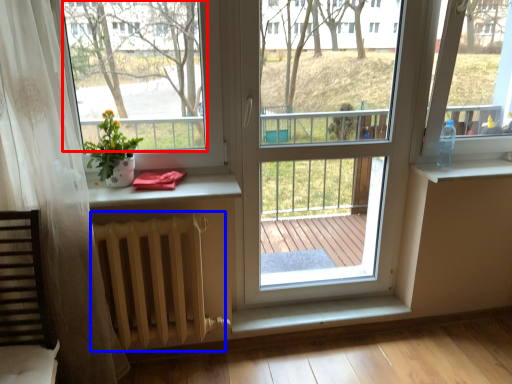
Question: Which object appears farthest to the camera in this image, window screen (highlighted by a red box) or radiator (highlighted by a blue box)?

Choices:
 (A) window screen
 (B) radiator

Answer: (B)